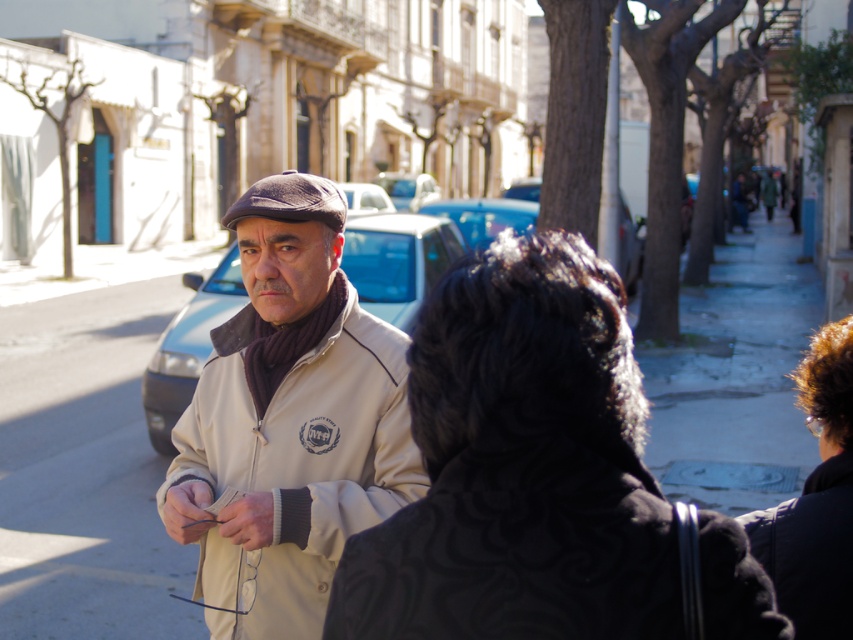
Question: Considering the relative positions of dark brown hair at lower right and matte blue car at center in the image provided, where is dark brown hair at lower right located with respect to matte blue car at center?

Choices:
 (A) left
 (B) right

Answer: (B)

Question: Can you confirm if black textured coat at center is positioned to the left of beige fabric jacket at center?

Choices:
 (A) no
 (B) yes

Answer: (A)

Question: Which point is closer to the camera?

Choices:
 (A) dark brown hair at lower right
 (B) black textured coat at center

Answer: (B)

Question: Which point is closer to the camera?

Choices:
 (A) beige fabric jacket at center
 (B) black textured jacket at center
 (C) matte blue car at center
 (D) black textured coat at center

Answer: (B)

Question: Does black textured coat at center have a smaller size compared to dark brown hair at lower right?

Choices:
 (A) yes
 (B) no

Answer: (A)

Question: Among these objects, which one is farthest from the camera?

Choices:
 (A) black textured jacket at center
 (B) dark brown hair at lower right
 (C) matte blue car at center
 (D) beige fabric jacket at center

Answer: (C)